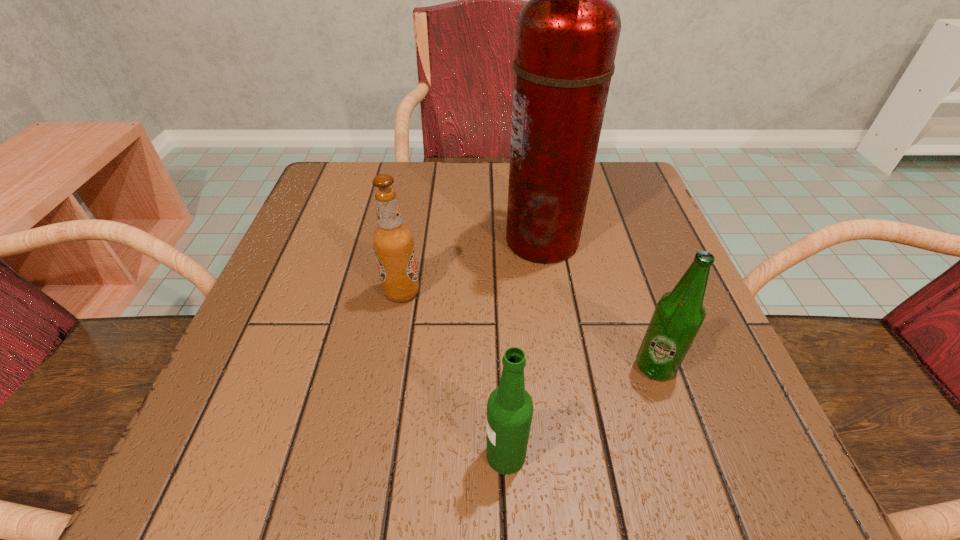
Locate an element on the screen. The width and height of the screenshot is (960, 540). the tallest object is located at coordinates (567, 34).

This screenshot has height=540, width=960. Identify the location of the farthest object. (567, 34).

You are a GUI agent. You are given a task and a screenshot of the screen. Output one action in this format:
    pyautogui.click(x=<x>, y=<y>)
    Task: Click on the second farthest object
    This screenshot has width=960, height=540.
    Given the screenshot: What is the action you would take?
    pyautogui.click(x=393, y=241)

I want to click on the leftmost beer bottle, so click(393, 241).

The height and width of the screenshot is (540, 960). Identify the location of the third farthest object. (679, 314).

I want to click on the rightmost beer bottle, so click(679, 314).

Where is `the nearest object`? the nearest object is located at coordinates (510, 407).

Locate an element on the screen. The height and width of the screenshot is (540, 960). the nearest beer bottle is located at coordinates (510, 407).

You are a GUI agent. You are given a task and a screenshot of the screen. Output one action in this format:
    pyautogui.click(x=<x>, y=<y>)
    Task: Click on the vacant position located 0.260m on the side of the farthest object with the handle and hose
    
    Given the screenshot: What is the action you would take?
    pyautogui.click(x=372, y=240)

Identify the location of vacant space located 0.230m on the side of the farthest object with the handle and hose. (388, 240).